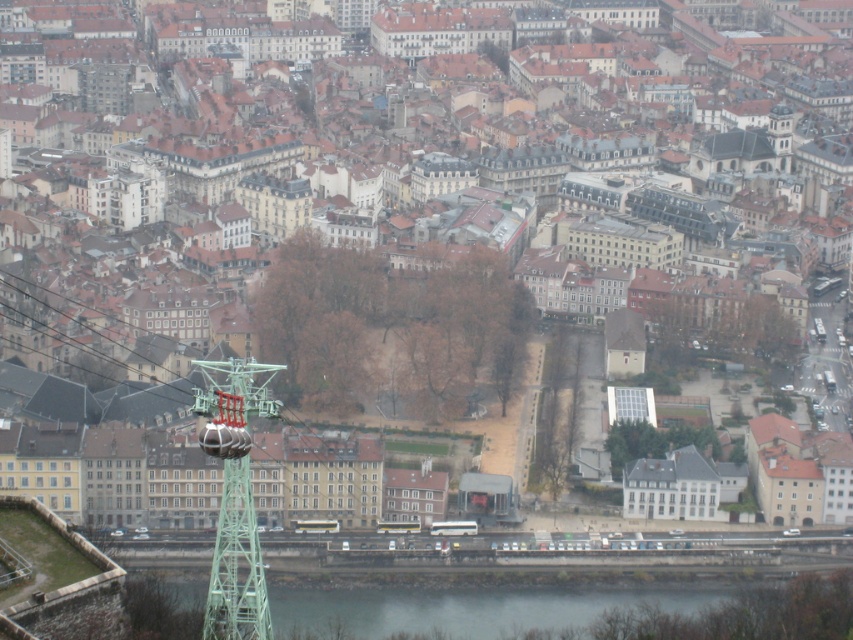
Looking at this image, you are a drone operator trying to capture a photo of the gray concrete river at lower center from above. According to the image coordinates, where should you position the drone to ensure the river is centered in the photo?

The gray concrete river at lower center is located at coordinates point (x=463, y=609), so you should position the drone directly above that point to center the river in the photo.

You are a tourist standing on a bridge overlooking the gray concrete river at lower center and the green metallic cable car tower at left. Which object is closer to your current position?

The gray concrete river at lower center is closer to your current position because it is further to the viewer than the green metallic cable car tower at left, meaning it appears nearer in the visual perspective.